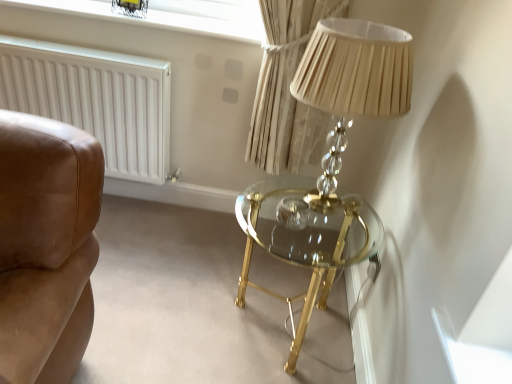
Question: In terms of height, does white matte radiator at left look taller or shorter compared to gold glass table at center?

Choices:
 (A) short
 (B) tall

Answer: (B)

Question: Is white matte radiator at left wider or thinner than gold glass table at center?

Choices:
 (A) wide
 (B) thin

Answer: (B)

Question: Which object is positioned closest to the clear glass window screen at upper center?

Choices:
 (A) white matte radiator at left
 (B) gold glass table at center

Answer: (A)

Question: Considering the real-world distances, which object is closest to the clear glass window screen at upper center?

Choices:
 (A) gold glass table at center
 (B) white matte radiator at left

Answer: (B)